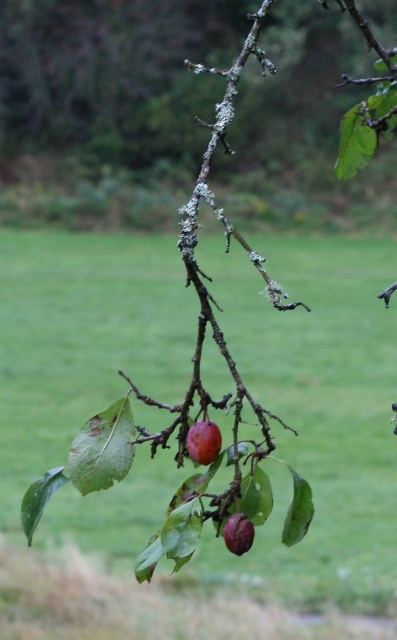
Between point (194, 451) and point (229, 524), which one is positioned behind?

Positioned behind is point (229, 524).

Is point (211, 448) farther from viewer compared to point (227, 518)?

That is False.

Where is `shiny red plum at center`? This screenshot has width=397, height=640. shiny red plum at center is located at coordinates (204, 442).

Between green grass at center and shiny purple plum at center, which one is positioned lower?

shiny purple plum at center is below.

Who is shorter, green grass at center or shiny purple plum at center?

With less height is shiny purple plum at center.

Identify the location of green grass at center. Image resolution: width=397 pixels, height=640 pixels. (316, 417).

Where is `green grass at center`? green grass at center is located at coordinates (316, 417).

Which is more to the right, green grass at center or shiny red plum at center?

Positioned to the right is shiny red plum at center.

Is green grass at center to the right of shiny red plum at center from the viewer's perspective?

Incorrect, green grass at center is not on the right side of shiny red plum at center.

The width and height of the screenshot is (397, 640). Identify the location of green grass at center. (316, 417).

What are the coordinates of `green grass at center` in the screenshot? It's located at (316, 417).